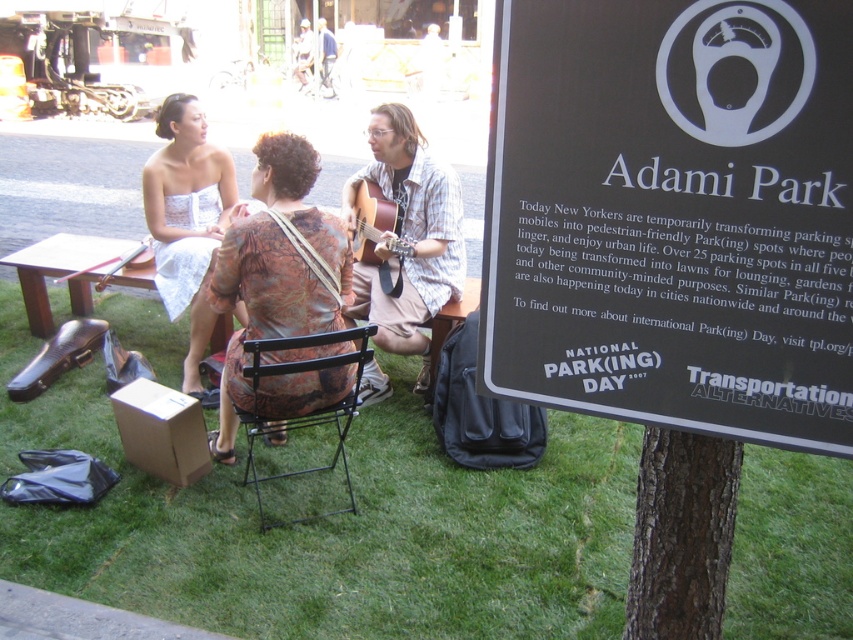
What do you see at coordinates (331, 525) in the screenshot? I see `green grass at lower center` at bounding box center [331, 525].

Which of these two, green grass at lower center or white lace dress at upper left, stands taller?

white lace dress at upper left

Is point (459, 550) less distant than point (199, 337)?

Yes, it is.

The width and height of the screenshot is (853, 640). In order to click on green grass at lower center in this screenshot , I will do `click(331, 525)`.

Locate an element on the screen. The width and height of the screenshot is (853, 640). black plastic sign at upper right is located at coordinates (672, 216).

Is black plastic sign at upper right closer to the viewer compared to brown textured dress at center?

Yes, it is in front of brown textured dress at center.

Identify the location of black plastic sign at upper right. (672, 216).

At what (x,y) coordinates should I click in order to perform the action: click on black plastic sign at upper right. Please return your answer as a coordinate pair (x, y). Looking at the image, I should click on (672, 216).

Does black plastic sign at upper right have a lesser height compared to brown rough bark tree at lower center?

In fact, black plastic sign at upper right may be taller than brown rough bark tree at lower center.

In order to click on black plastic sign at upper right in this screenshot , I will do `click(672, 216)`.